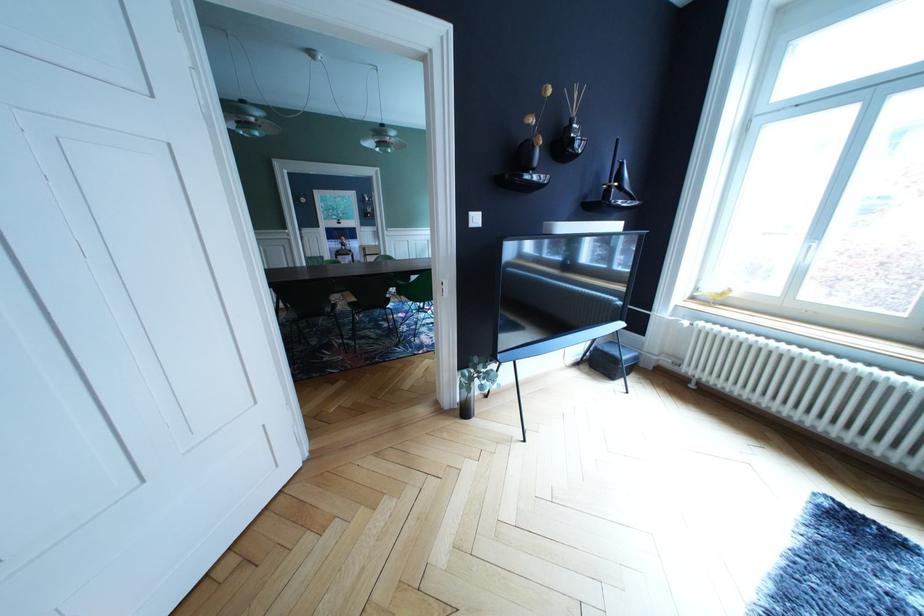
Where would you lift the tall floor vase? Please return your answer as a coordinate pair (x, y).

(526, 169)